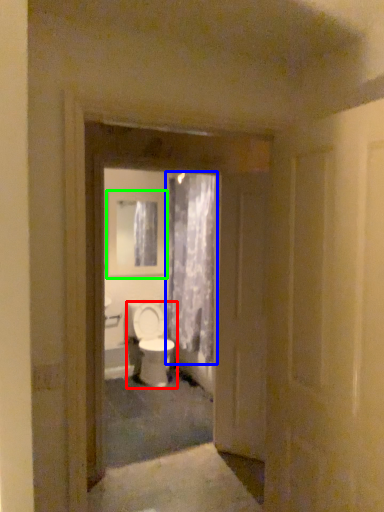
Question: Which object is the farthest from toilet (highlighted by a red box)? Choose among these: curtain (highlighted by a blue box) or medicine cabinet (highlighted by a green box).

Choices:
 (A) curtain
 (B) medicine cabinet

Answer: (B)